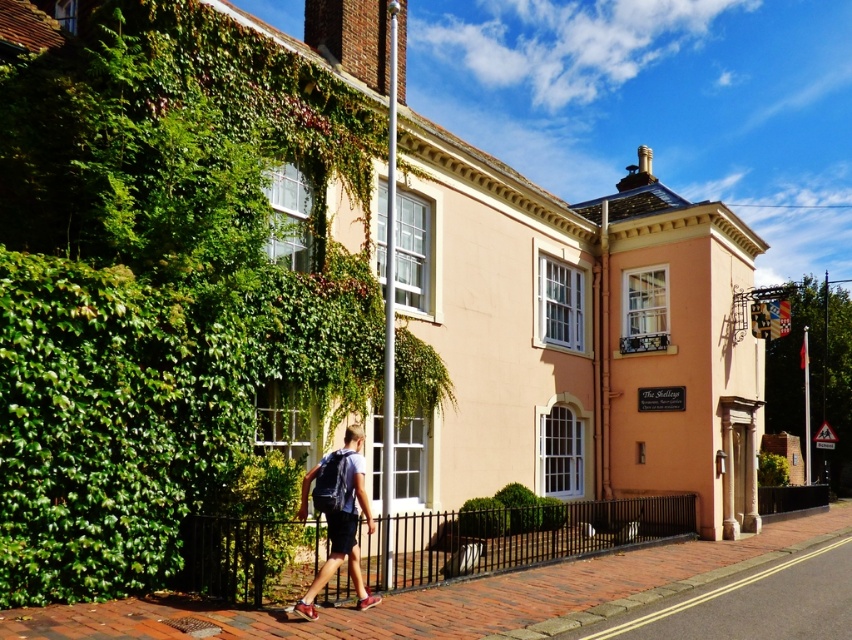
Question: Which of the following is the farthest from the observer?

Choices:
 (A) green ivy hedge at left
 (B) brick pavement at lower center
 (C) denim shorts at lower left

Answer: (A)

Question: Does green ivy hedge at left come in front of brick pavement at lower center?

Choices:
 (A) no
 (B) yes

Answer: (A)

Question: Which of the following is the farthest from the observer?

Choices:
 (A) (648, 595)
 (B) (348, 499)
 (C) (102, 568)

Answer: (A)

Question: Which point is closer to the camera?

Choices:
 (A) (x=764, y=531)
 (B) (x=327, y=488)

Answer: (B)

Question: From the image, what is the correct spatial relationship of green ivy hedge at left in relation to denim shorts at lower left?

Choices:
 (A) right
 (B) left

Answer: (B)

Question: Is green ivy hedge at left to the right of brick pavement at lower center from the viewer's perspective?

Choices:
 (A) no
 (B) yes

Answer: (A)